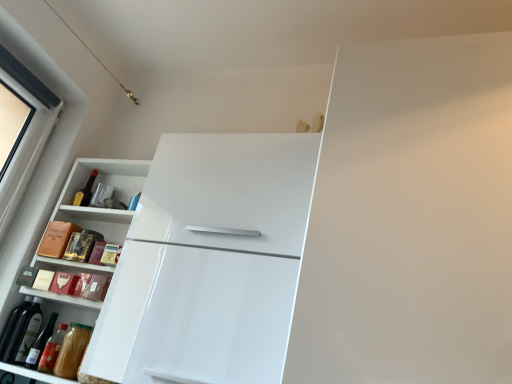
Question: In the image, is matte glass bottle at upper left on the left side or the right side of white glossy cabinet at left?

Choices:
 (A) left
 (B) right

Answer: (A)

Question: From a real-world perspective, is matte glass bottle at upper left physically located above or below white glossy cabinet at left?

Choices:
 (A) below
 (B) above

Answer: (B)

Question: Which object is the farthest from the white glossy refrigerator at upper center?

Choices:
 (A) green glass wine bottle at lower left
 (B) white glossy cabinet at left
 (C) matte glass bottle at upper left

Answer: (C)

Question: Estimate the real-world distances between objects in this image. Which object is farther from the green glass wine bottle at lower left?

Choices:
 (A) white glossy cabinet at left
 (B) white glossy refrigerator at upper center
 (C) matte glass bottle at upper left

Answer: (B)